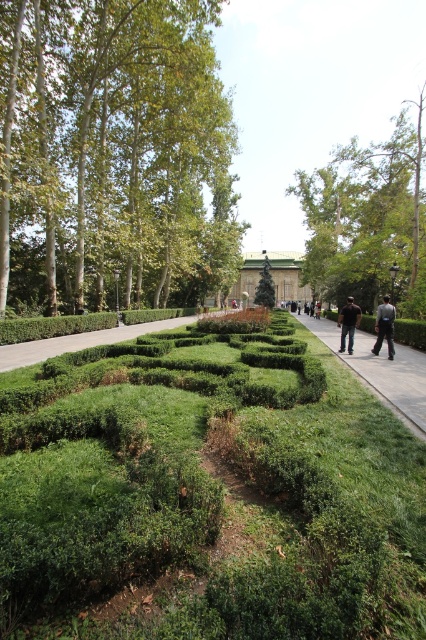
Can you confirm if green leafy hedge at center is shorter than smooth white tree at upper left?

Yes.

Is point (345, 461) positioned in front of point (14, 58)?

Yes, it is.

Find the location of `green leafy hedge at center`. green leafy hedge at center is located at coordinates (212, 488).

Does smooth white tree at upper left have a larger size compared to dark gray uniform at center?

Yes.

Is point (175, 250) in front of point (391, 320)?

No, it is not.

Who is more distant from viewer, [186,92] or [388,333]?

Point [186,92]

Locate an element on the screen. This screenshot has width=426, height=640. smooth white tree at upper left is located at coordinates (114, 156).

Can you confirm if green leafy tree at upper center is thinner than gray concrete sidewalk at center?

No, green leafy tree at upper center is not thinner than gray concrete sidewalk at center.

Is green leafy tree at upper center wider than gray concrete sidewalk at center?

Indeed, green leafy tree at upper center has a greater width compared to gray concrete sidewalk at center.

The height and width of the screenshot is (640, 426). Find the location of `green leafy tree at upper center`. green leafy tree at upper center is located at coordinates (368, 218).